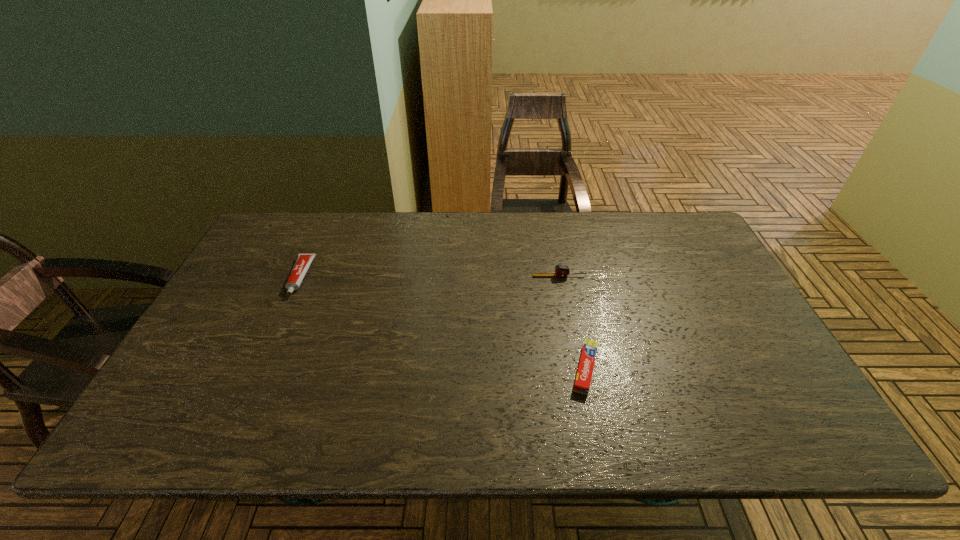
Where is `tape measure`? tape measure is located at coordinates (560, 270).

Locate an element on the screen. This screenshot has height=540, width=960. the leftmost object is located at coordinates click(x=303, y=261).

I want to click on the farther toothpaste, so click(303, 261).

This screenshot has height=540, width=960. Find the location of `the shortest object`. the shortest object is located at coordinates [x=583, y=379].

You are a GUI agent. You are given a task and a screenshot of the screen. Output one action in this format:
    pyautogui.click(x=<x>, y=<y>)
    Task: Click on the shorter toothpaste
    This screenshot has width=960, height=540.
    Given the screenshot: What is the action you would take?
    pyautogui.click(x=583, y=379)

Image resolution: width=960 pixels, height=540 pixels. In order to click on vacant space situated 0.100m on the right of the tape measure in this screenshot , I will do `click(619, 276)`.

Locate an element on the screen. This screenshot has height=540, width=960. free space located 0.320m at the nozzle of the taller toothpaste is located at coordinates (246, 397).

Where is `free space located 0.280m on the right of the shortest object`? The image size is (960, 540). free space located 0.280m on the right of the shortest object is located at coordinates point(718,369).

You are a GUI agent. You are given a task and a screenshot of the screen. Output one action in this format:
    pyautogui.click(x=<x>, y=<y>)
    Task: Click on the vacant space at the far edge of the desktop
    
    Given the screenshot: What is the action you would take?
    pyautogui.click(x=415, y=224)

Locate an element on the screen. Image resolution: width=960 pixels, height=540 pixels. vacant space at the near edge of the desktop is located at coordinates click(663, 409).